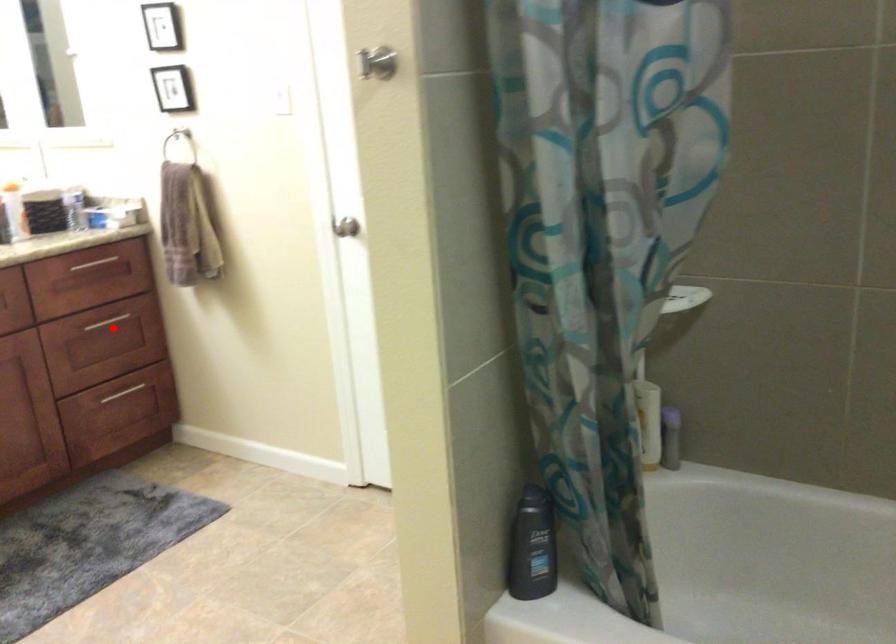
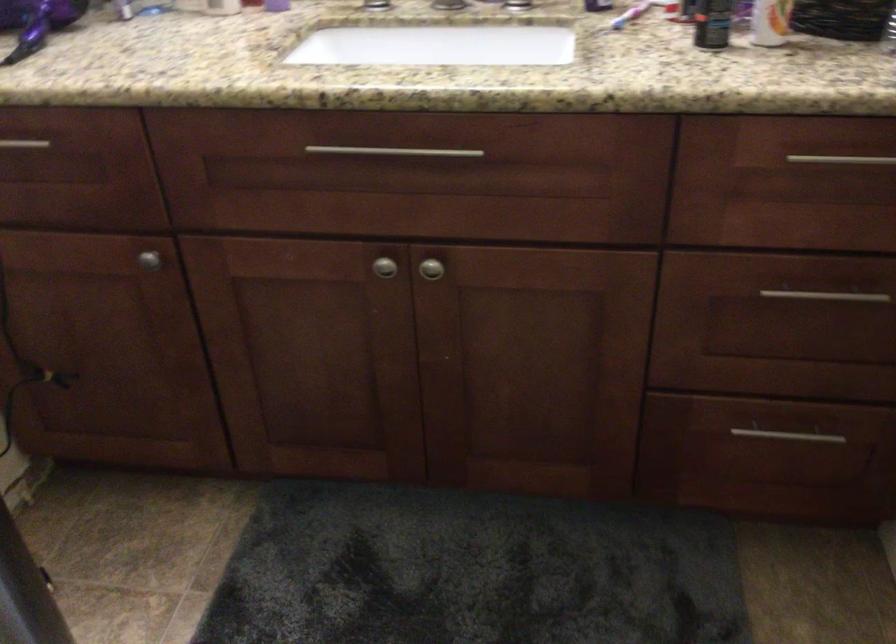
Where in the second image is the point corresponding to the highlighted location from the first image?

(815, 310)